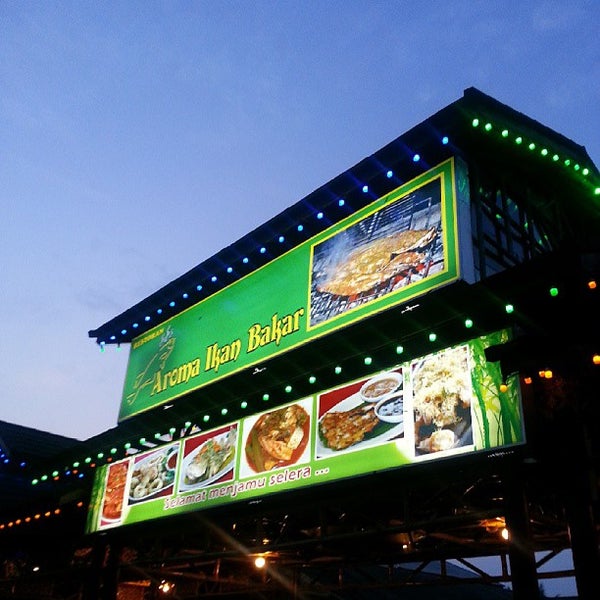
In order to click on picture in this screenshot , I will do `click(107, 501)`, `click(150, 480)`, `click(225, 460)`, `click(279, 450)`, `click(375, 422)`, `click(459, 420)`, `click(401, 250)`.